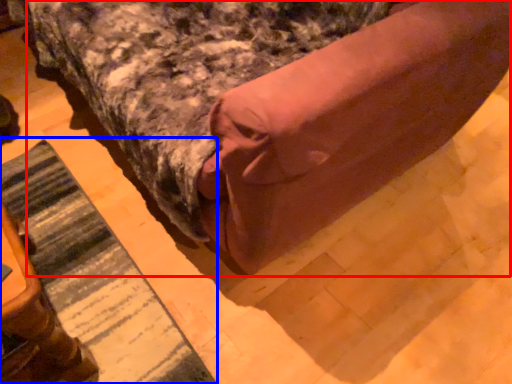
Question: Which object appears closest to the camera in this image, bed (highlighted by a red box) or mat (highlighted by a blue box)?

Choices:
 (A) bed
 (B) mat

Answer: (A)